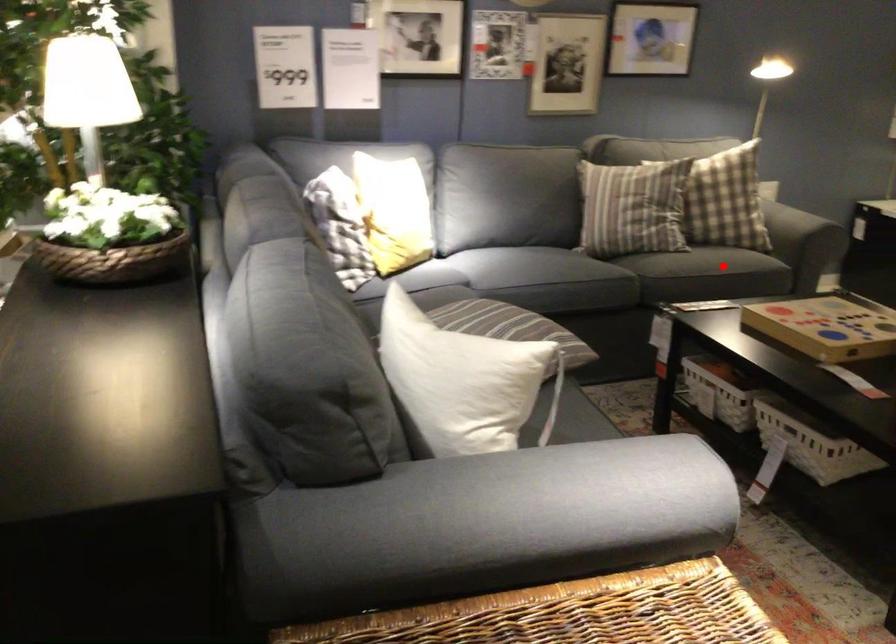
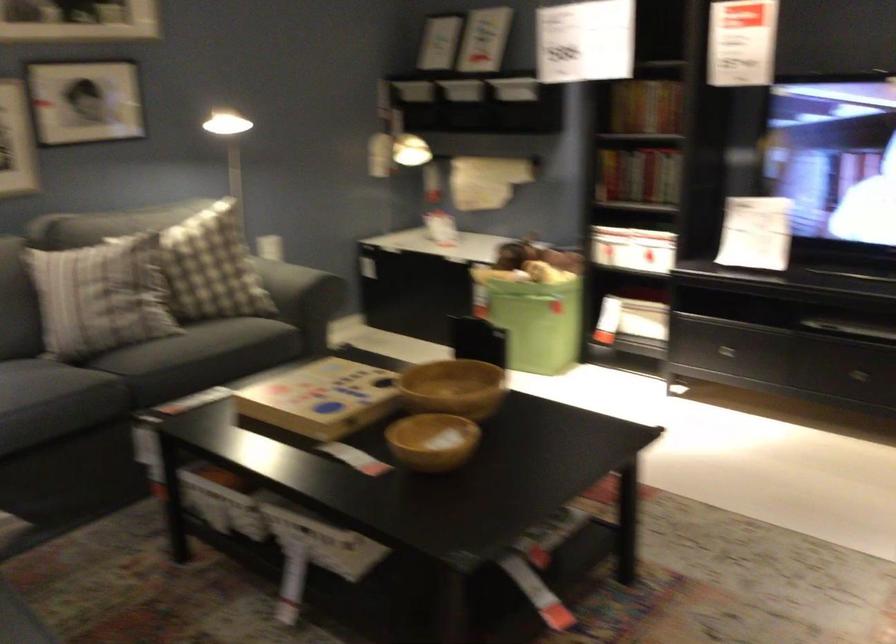
Question: A red point is marked in image1. In image2, is the corresponding 3D point closer to the camera or farther? Reply with the corresponding letter.

Choices:
 (A) The corresponding 3D point is closer.
 (B) The corresponding 3D point is farther.

Answer: (A)